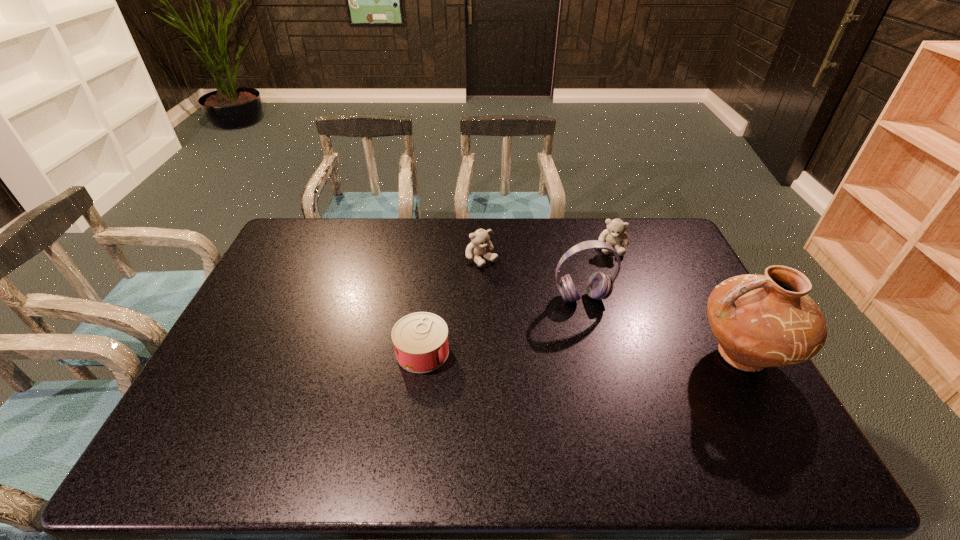
Locate an element on the screen. The height and width of the screenshot is (540, 960). blank area in the image that satisfies the following two spatial constraints: 1. on the front side of the pottery; 2. on the side of the fourth object from left to right with the handle is located at coordinates (653, 355).